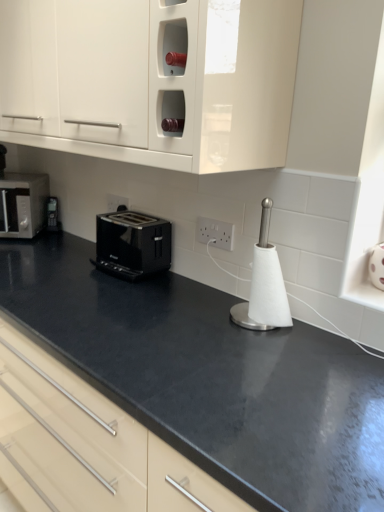
Question: Does matte silver toaster at left have a lesser width compared to black glossy toaster at center?

Choices:
 (A) no
 (B) yes

Answer: (A)

Question: Does matte silver toaster at left have a lesser height compared to black glossy toaster at center?

Choices:
 (A) no
 (B) yes

Answer: (A)

Question: Does matte silver toaster at left have a greater width compared to black glossy toaster at center?

Choices:
 (A) no
 (B) yes

Answer: (B)

Question: Is matte silver toaster at left positioned behind black glossy toaster at center?

Choices:
 (A) no
 (B) yes

Answer: (B)

Question: Can you see matte silver toaster at left touching black glossy toaster at center?

Choices:
 (A) yes
 (B) no

Answer: (B)

Question: Would you say matte silver toaster at left is a long distance from black glossy toaster at center?

Choices:
 (A) no
 (B) yes

Answer: (A)

Question: From the image's perspective, is white plastic electrical outlet at center, placed as the second electric outlet when sorted from right to left, beneath white paper towel holder at center?

Choices:
 (A) no
 (B) yes

Answer: (A)

Question: Is white plastic electrical outlet at center, placed as the second electric outlet when sorted from right to left, completely or partially outside of white paper towel holder at center?

Choices:
 (A) yes
 (B) no

Answer: (A)

Question: Is white plastic electrical outlet at center, the first electric outlet from the back, bigger than white paper towel holder at center?

Choices:
 (A) no
 (B) yes

Answer: (A)

Question: Considering the relative sizes of white plastic electrical outlet at center, the 2th electric outlet from the front, and white paper towel holder at center in the image provided, is white plastic electrical outlet at center, the 2th electric outlet from the front, thinner than white paper towel holder at center?

Choices:
 (A) no
 (B) yes

Answer: (B)

Question: Considering the relative sizes of white plastic electrical outlet at center, placed as the second electric outlet when sorted from right to left, and white paper towel holder at center in the image provided, is white plastic electrical outlet at center, placed as the second electric outlet when sorted from right to left, taller than white paper towel holder at center?

Choices:
 (A) no
 (B) yes

Answer: (A)

Question: From a real-world perspective, is white plastic electrical outlet at center, placed as the 2th electric outlet when sorted from bottom to top, located higher than white paper towel holder at center?

Choices:
 (A) no
 (B) yes

Answer: (B)

Question: Does white paper towel holder at center have a larger size compared to white plastic electric outlet at center, positioned as the 2th electric outlet in top-to-bottom order?

Choices:
 (A) no
 (B) yes

Answer: (B)